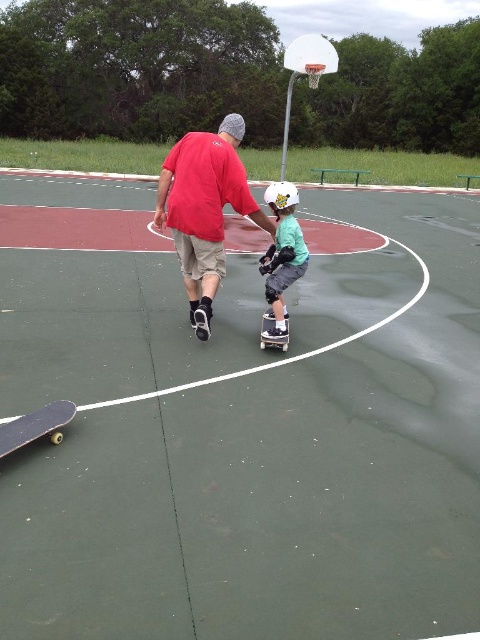
Is matte green helmet at center smaller than wooden skateboard at lower left?

Actually, matte green helmet at center might be larger than wooden skateboard at lower left.

Which of these two, matte green helmet at center or wooden skateboard at lower left, stands taller?

matte green helmet at center

Locate an element on the screen. This screenshot has width=480, height=640. matte green helmet at center is located at coordinates (282, 256).

Image resolution: width=480 pixels, height=640 pixels. Find the location of `matte green helmet at center`. matte green helmet at center is located at coordinates (282, 256).

Does matte green helmet at center have a smaller size compared to white plastic basketball hoop at upper center?

Indeed, matte green helmet at center has a smaller size compared to white plastic basketball hoop at upper center.

Who is higher up, matte green helmet at center or white plastic basketball hoop at upper center?

white plastic basketball hoop at upper center is higher up.

What do you see at coordinates (282, 256) in the screenshot?
I see `matte green helmet at center` at bounding box center [282, 256].

Identify the location of matte green helmet at center. (282, 256).

Between matte red shirt at center and matte green helmet at center, which one is positioned higher?

matte red shirt at center

Does point (180, 260) come in front of point (283, 337)?

No, it is not.

Locate an element on the screen. matte red shirt at center is located at coordinates (204, 209).

I want to click on matte red shirt at center, so click(x=204, y=209).